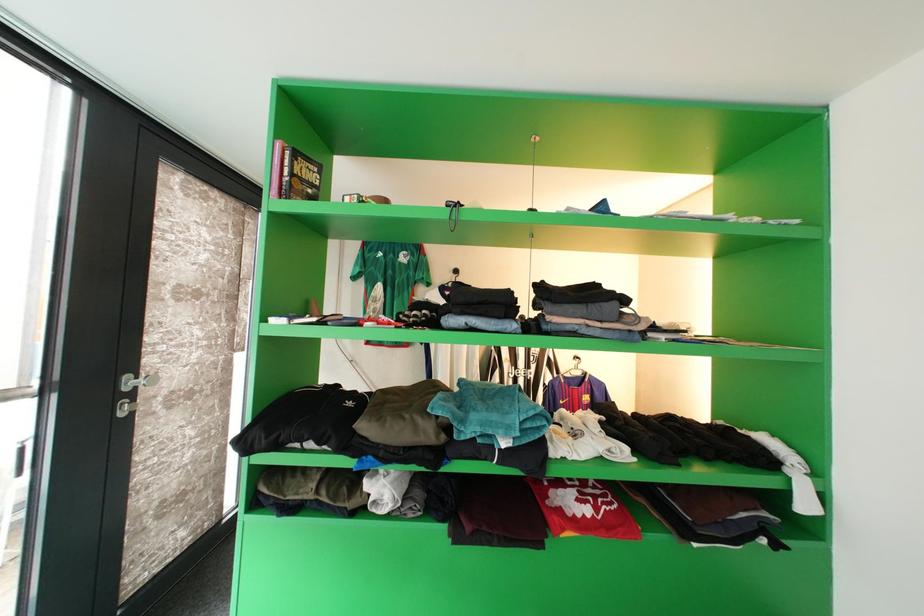
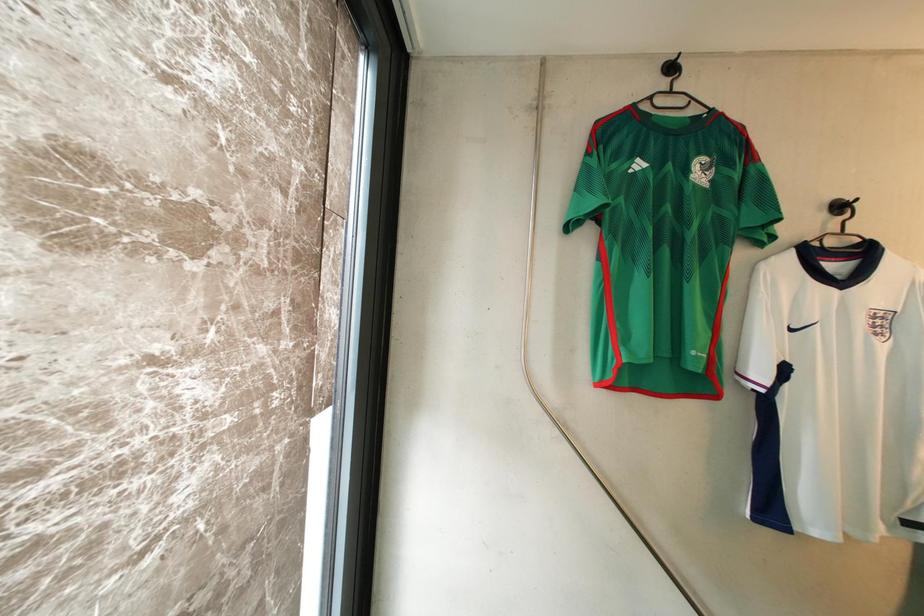
The images are taken continuously from a first-person perspective. In which direction are you moving?

The movement direction of the cameraman is left, forward.